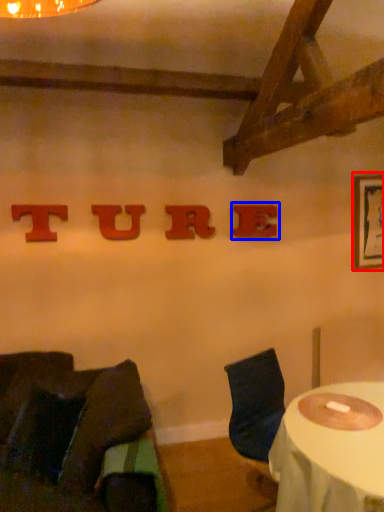
Question: Which object is closer to the camera taking this photo, picture frame (highlighted by a red box) or alphabet (highlighted by a blue box)?

Choices:
 (A) picture frame
 (B) alphabet

Answer: (B)